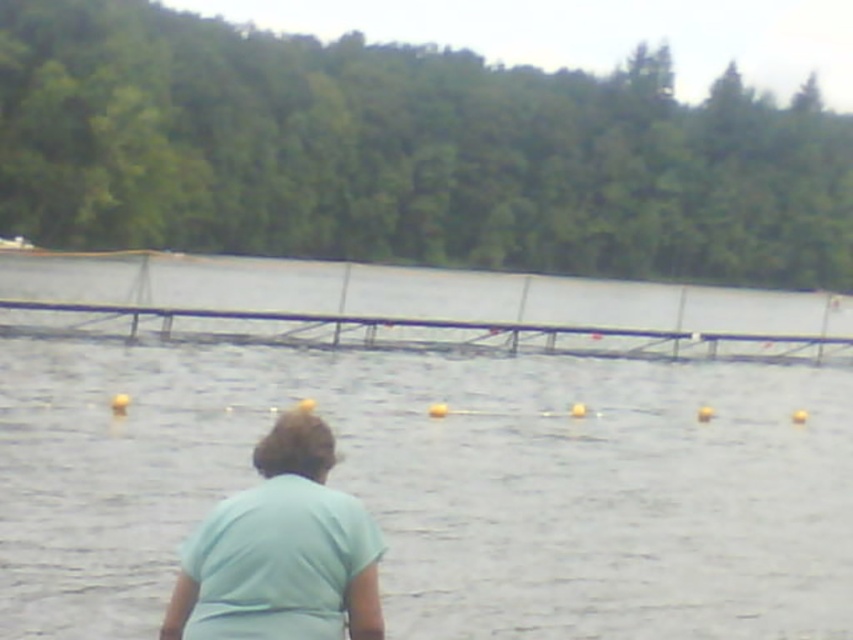
Is clear water at center below light blue fabric at center?

No, clear water at center is not below light blue fabric at center.

Which is in front, point (409, 547) or point (320, 628)?

Positioned in front is point (320, 628).

Which is in front, point (314, 368) or point (265, 483)?

Positioned in front is point (265, 483).

Image resolution: width=853 pixels, height=640 pixels. What are the coordinates of `clear water at center` in the screenshot? It's located at (431, 444).